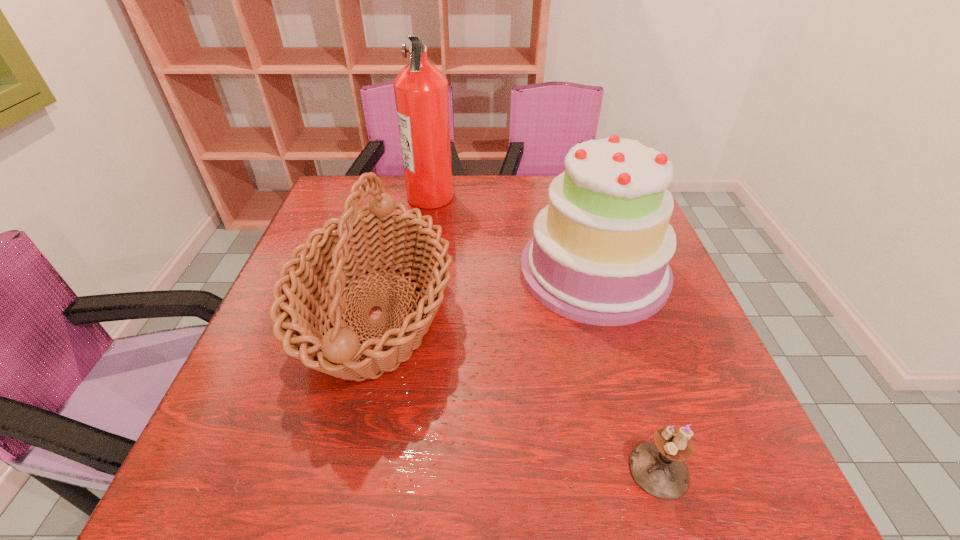
What are the coordinates of `free space between the nearest object and the fire extinguisher` in the screenshot? It's located at (544, 333).

Where is `vacant area that lies between the cake and the tallest object`? vacant area that lies between the cake and the tallest object is located at coordinates (513, 234).

Where is `free space between the cake and the basket`? free space between the cake and the basket is located at coordinates 485,293.

Identify the location of unoccupied area between the basket and the cake. The image size is (960, 540). (485, 293).

Find the location of a particular element. vacant point located between the cake and the basket is located at coordinates (485, 293).

This screenshot has width=960, height=540. I want to click on free point between the farthest object and the candle holder, so click(x=544, y=333).

This screenshot has width=960, height=540. Identify the location of vacant space that's between the cake and the basket. (485, 293).

At what (x,y) coordinates should I click in order to perform the action: click on free space between the fire extinguisher and the nearest object. Please return your answer as a coordinate pair (x, y). The width and height of the screenshot is (960, 540). Looking at the image, I should click on (544, 333).

You are a GUI agent. You are given a task and a screenshot of the screen. Output one action in this format:
    pyautogui.click(x=<x>, y=<y>)
    Task: Click on the free space that is in between the nearest object and the basket
    Image resolution: width=960 pixels, height=540 pixels.
    Given the screenshot: What is the action you would take?
    pyautogui.click(x=517, y=393)

Identify which object is located as the third nearest to the candle holder. Please provide its 2D coordinates. Your answer should be formatted as a tuple, i.e. [(x, y)], where the tuple contains the x and y coordinates of a point satisfying the conditions above.

[(421, 93)]